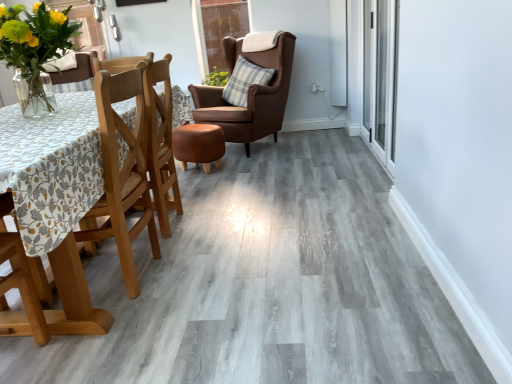
Question: Which is correct: transparent glass door at upper center, the second glass door in the front-to-back sequence, is inside plaid fabric pillow at center, marked as the 1th pillow in a right-to-left arrangement, or outside of it?

Choices:
 (A) outside
 (B) inside

Answer: (A)

Question: From a real-world perspective, is transparent glass door at upper center, the second glass door in the front-to-back sequence, positioned above or below plaid fabric pillow at center, marked as the 1th pillow in a right-to-left arrangement?

Choices:
 (A) below
 (B) above

Answer: (B)

Question: Estimate the real-world distances between objects in this image. Which object is farther from the translucent glass vase with yellow flowers at left?

Choices:
 (A) transparent glass door at upper center, arranged as the 2th glass door when viewed from the right
 (B) wooden chair at left, arranged as the 1th chair when ordered from the bottom
 (C) brown leather wingback chair at center, which is counted as the 2th chair, starting from the front
 (D) plaid fabric pillow at center, which is the 2th pillow from left to right
 (E) transparent glass door at upper right, arranged as the second glass door when viewed from the left

Answer: (A)

Question: Estimate the real-world distances between objects in this image. Which object is farther from the transparent glass door at upper right, arranged as the second glass door when viewed from the left?

Choices:
 (A) transparent glass door at upper center, arranged as the 2th glass door when viewed from the right
 (B) white soft pillow at upper left, acting as the second pillow starting from the right
 (C) brown leather wingback chair at center, placed as the second chair when sorted from bottom to top
 (D) plaid fabric pillow at center, which is the 2th pillow from left to right
 (E) translucent glass vase with yellow flowers at left

Answer: (B)